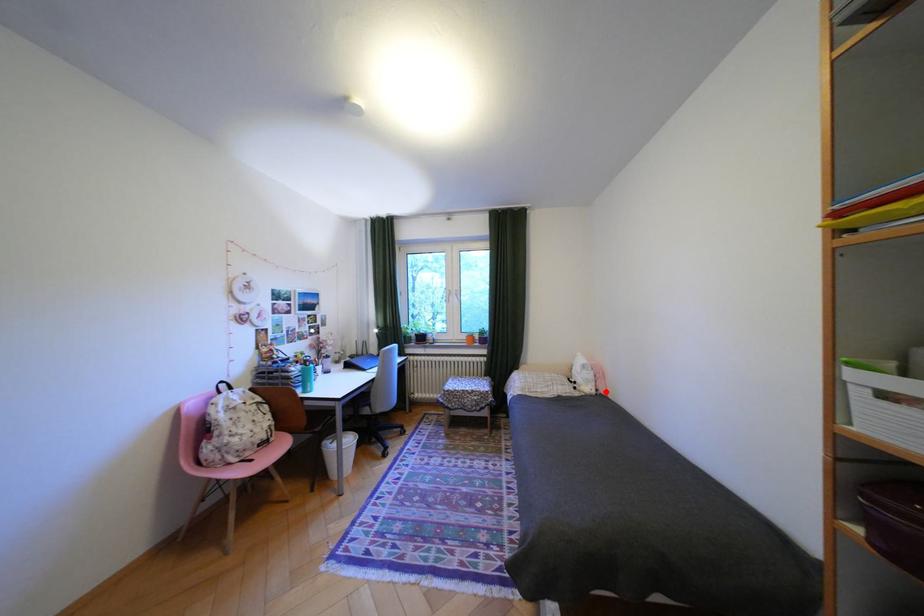
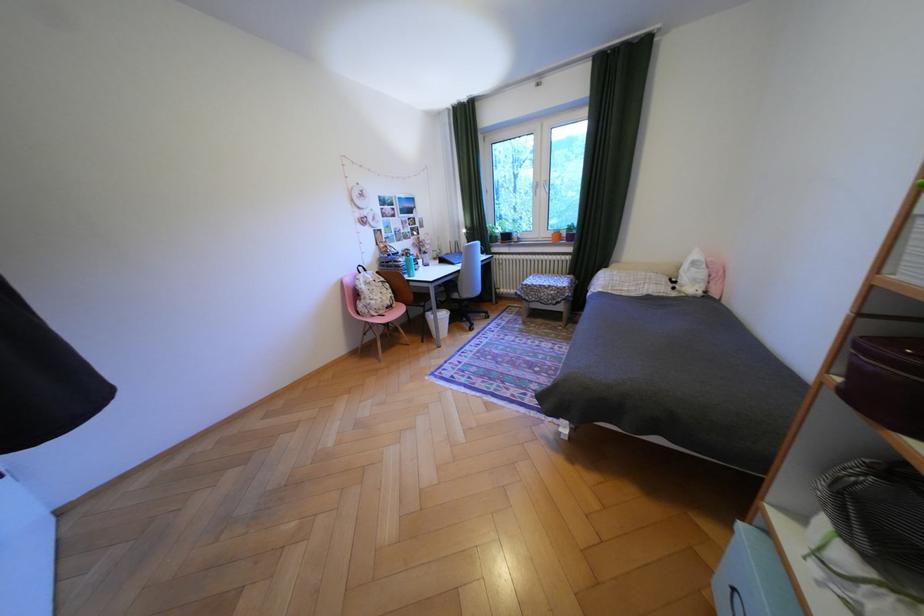
Question: I am providing you with two images of the same scene from different viewpoints. A red point is marked on the first image. At the location where the point appears in image 1, is it still visible in image 2?

Choices:
 (A) Yes
 (B) No

Answer: (A)